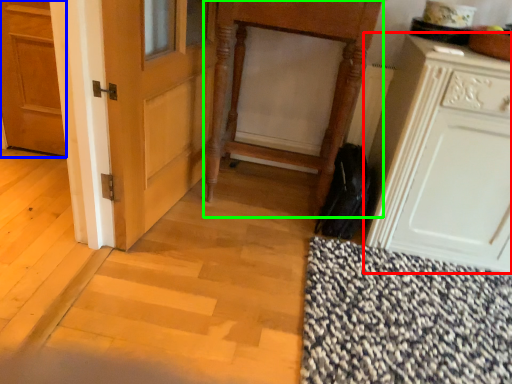
Question: Which object is positioned farthest from cabinetry (highlighted by a red box)? Select from door (highlighted by a blue box) and vanity (highlighted by a green box).

Choices:
 (A) door
 (B) vanity

Answer: (A)